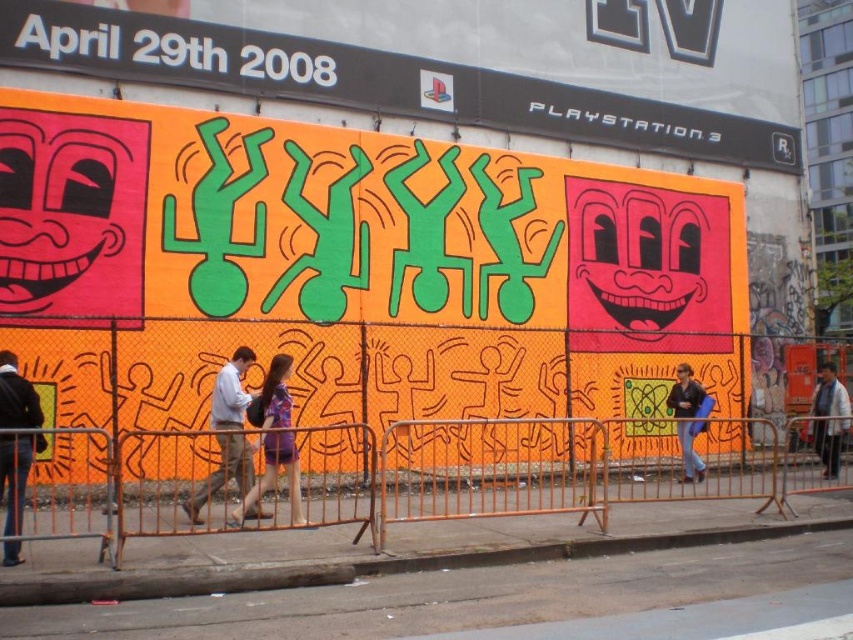
Does orange matte wall art at center have a lesser width compared to matte black jacket at center?

Incorrect, orange matte wall art at center's width is not less than matte black jacket at center's.

The width and height of the screenshot is (853, 640). In order to click on orange matte wall art at center in this screenshot , I will do `click(355, 252)`.

The width and height of the screenshot is (853, 640). What do you see at coordinates (355, 252) in the screenshot? I see `orange matte wall art at center` at bounding box center [355, 252].

At what (x,y) coordinates should I click in order to perform the action: click on orange matte wall art at center. Please return your answer as a coordinate pair (x, y). The width and height of the screenshot is (853, 640). Looking at the image, I should click on (355, 252).

Which of these two, orange metal fence at center or matte purple dress at center, stands shorter?

orange metal fence at center

Is orange metal fence at center taller than matte purple dress at center?

No, orange metal fence at center is not taller than matte purple dress at center.

Which is in front, point (64, 504) or point (280, 420)?

Point (280, 420) is in front.

Locate an element on the screen. orange metal fence at center is located at coordinates 456,476.

Between orange matte wall art at center and orange metal fence at center, which one is positioned lower?

orange metal fence at center is below.

Is point (685, 250) farther from viewer compared to point (306, 525)?

Yes.

What do you see at coordinates (355, 252) in the screenshot?
I see `orange matte wall art at center` at bounding box center [355, 252].

At what (x,y) coordinates should I click in order to perform the action: click on orange matte wall art at center. Please return your answer as a coordinate pair (x, y). This screenshot has width=853, height=640. Looking at the image, I should click on (355, 252).